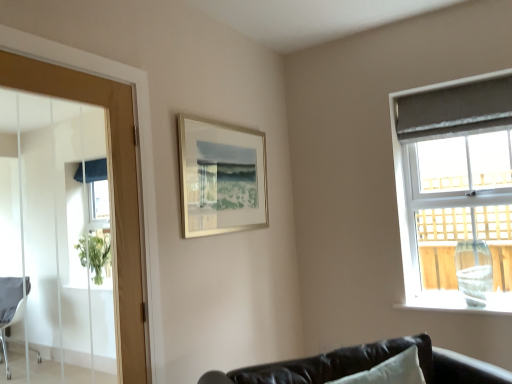
Question: Visually, is wooden door at left positioned to the left or to the right of matte gray curtain at right?

Choices:
 (A) right
 (B) left

Answer: (B)

Question: From a real-world perspective, relative to matte gray curtain at right, is wooden door at left vertically above or below?

Choices:
 (A) below
 (B) above

Answer: (A)

Question: Which of these objects is positioned closest to the silver metallic picture frame at upper center?

Choices:
 (A) gray fabric curtain at upper right
 (B) matte gray curtain at right
 (C) wooden door at left

Answer: (C)

Question: Which object is positioned farthest from the silver metallic picture frame at upper center?

Choices:
 (A) matte gray curtain at right
 (B) gray fabric curtain at upper right
 (C) wooden door at left

Answer: (B)